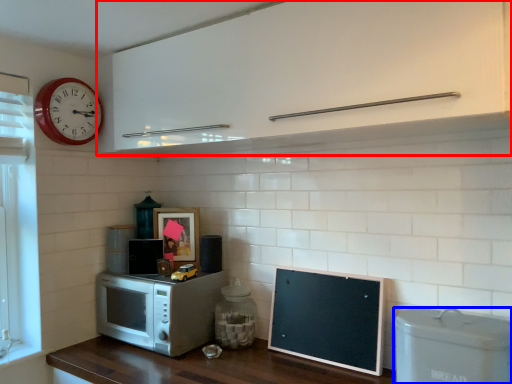
Question: Which point is closer to the camera, cabinetry (highlighted by a red box) or appliance (highlighted by a blue box)?

Choices:
 (A) cabinetry
 (B) appliance

Answer: (A)